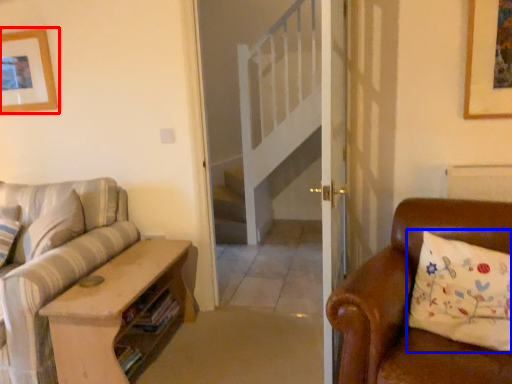
Question: Which of the following is the closest to the observer, picture frame (highlighted by a red box) or pillow (highlighted by a blue box)?

Choices:
 (A) picture frame
 (B) pillow

Answer: (B)